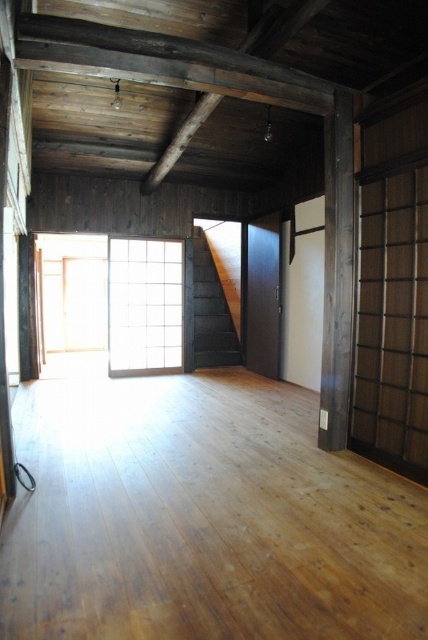
Who is positioned more to the left, white grid screen at center or brown wooden beam at center?

white grid screen at center is more to the left.

Can you confirm if white grid screen at center is taller than brown wooden beam at center?

Correct, white grid screen at center is much taller as brown wooden beam at center.

Which is behind, point (171, 356) or point (178, 134)?

Point (171, 356)

Image resolution: width=428 pixels, height=640 pixels. Identify the location of white grid screen at center. coord(145,305).